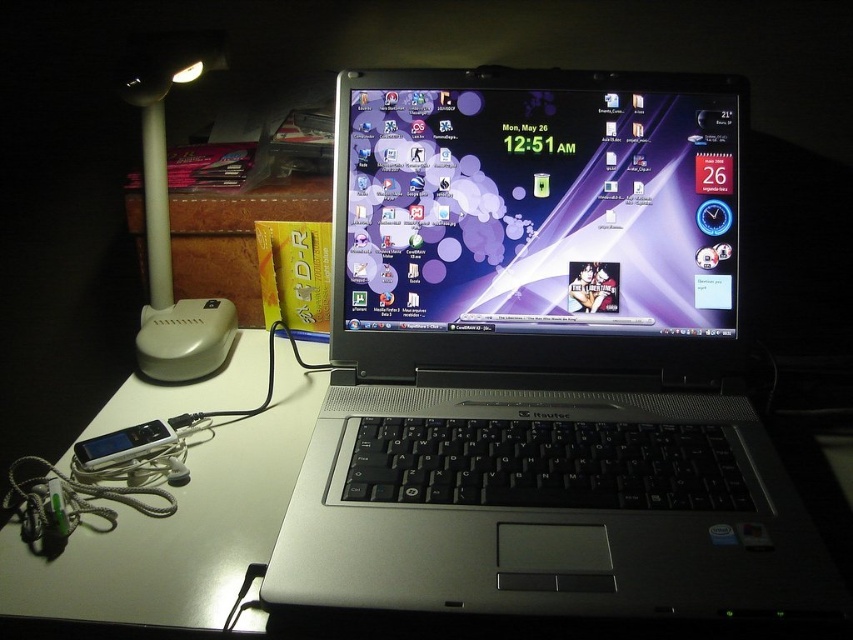
Question: Considering the relative positions of matte plastic screen at center and white plastic table lamp at upper left in the image provided, where is matte plastic screen at center located with respect to white plastic table lamp at upper left?

Choices:
 (A) left
 (B) right

Answer: (B)

Question: Which point is closer to the camera?

Choices:
 (A) silver/black plastic laptop at center
 (B) matte plastic screen at center
 (C) white glossy table at center
 (D) satin silver ipod at lower left

Answer: (A)

Question: Is matte plastic screen at center bigger than white glossy table at center?

Choices:
 (A) no
 (B) yes

Answer: (A)

Question: Among these objects, which one is nearest to the camera?

Choices:
 (A) white glossy table at center
 (B) silver/black plastic laptop at center
 (C) white plastic table lamp at upper left

Answer: (B)

Question: Which point is closer to the camera?

Choices:
 (A) (392, 163)
 (B) (84, 445)

Answer: (B)

Question: Does silver/black plastic laptop at center appear on the left side of white glossy table at center?

Choices:
 (A) yes
 (B) no

Answer: (B)